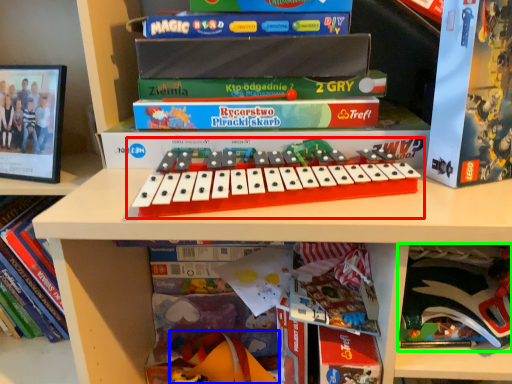
Question: Considering the real-world distances, which object is farthest from musical keyboard (highlighted by a red box)? toy (highlighted by a blue box) or paperback book (highlighted by a green box)?

Choices:
 (A) toy
 (B) paperback book

Answer: (A)